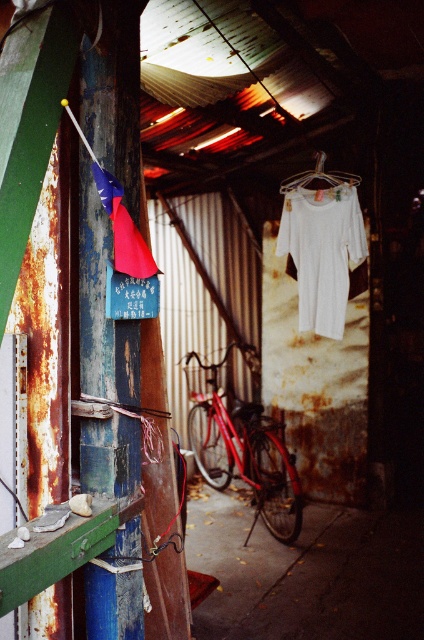
You are an observer in the workshop and notice two white items at the center. Which one is closer to you, the white cotton pants at center or the white fabric at center?

The white cotton pants at center is in front of the white fabric at center, so it is closer to you.

From the picture: You are a tailor working in this workshop and need to determine if the white cotton pants at center can be placed on top of the white fabric at center without overlapping. The pants are 21.28 inches long. Is there enough space between them for this?

The white cotton pants at center is 21.28 inches from white fabric at center, so the distance between them is exactly the length of the pants. Therefore, the pants can be placed on top of the white fabric at center without overlapping as long as they are aligned properly.